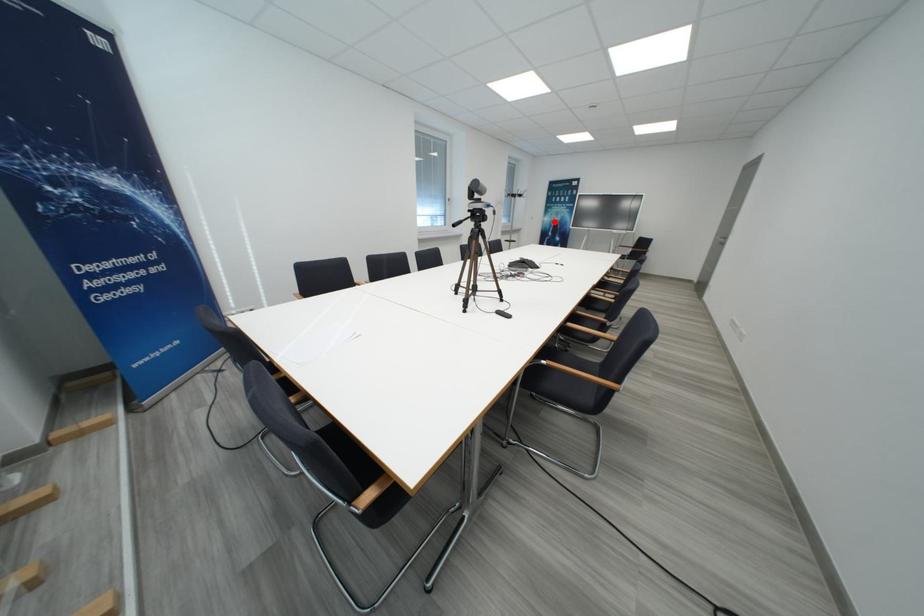
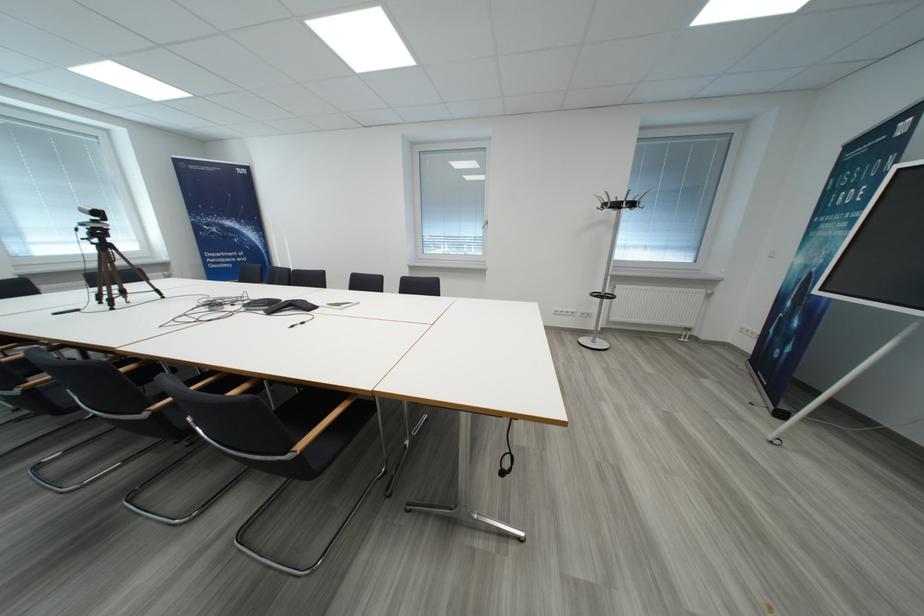
Question: I am providing you with two images of the same scene from different viewpoints. A red point is marked on the first image. Can you still see the location of the red point in image 2?

Choices:
 (A) Yes
 (B) No

Answer: (A)